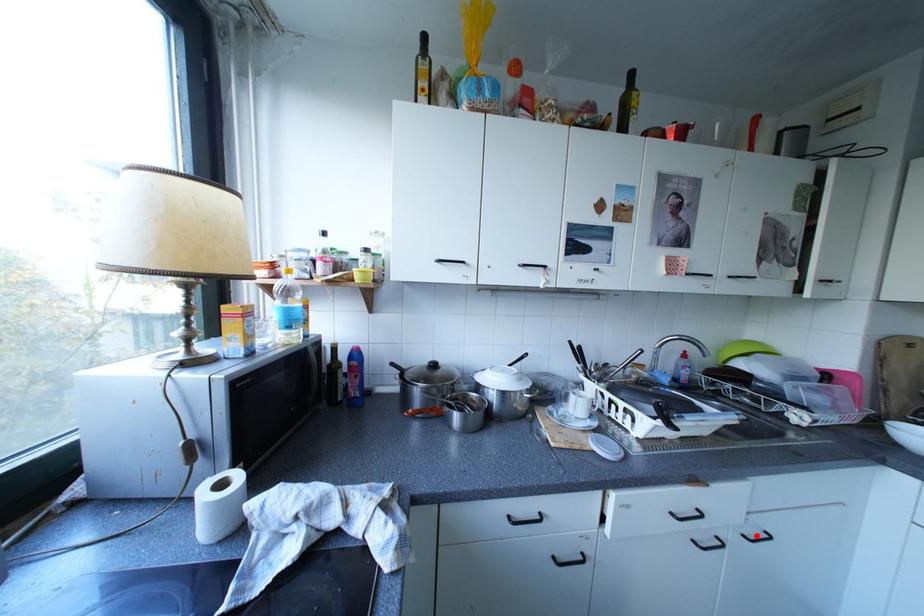
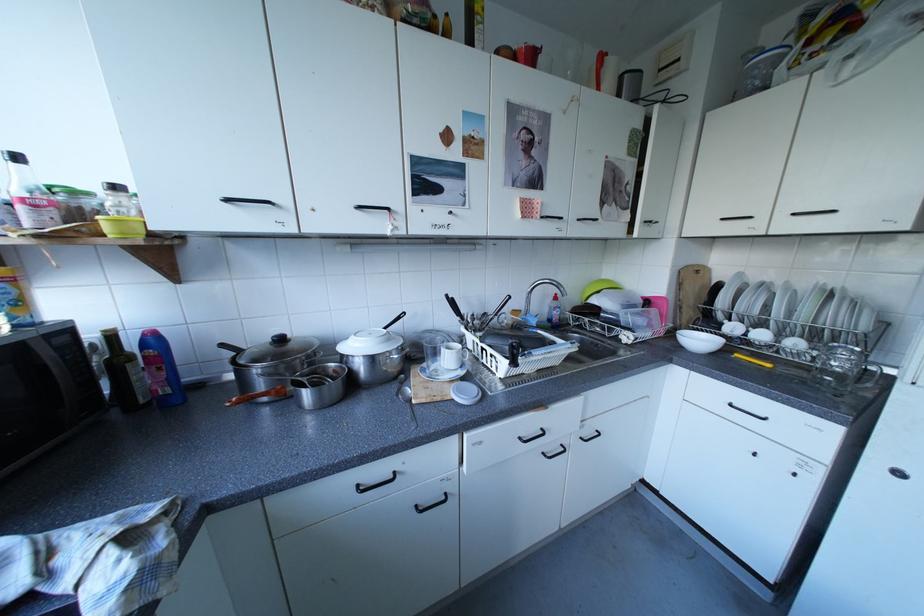
Find the pixel in the second image that matches the highlighted location in the first image.

(593, 439)